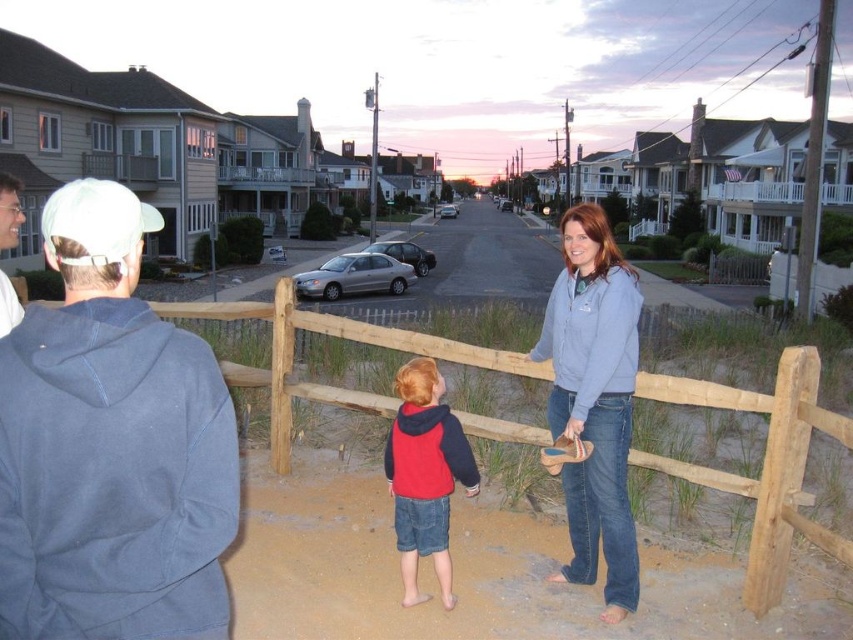
Is light blue fleece jacket at left thinner than red fleece jacket at center?

No, light blue fleece jacket at left is not thinner than red fleece jacket at center.

Does light blue fleece jacket at left appear on the right side of red fleece jacket at center?

In fact, light blue fleece jacket at left is to the left of red fleece jacket at center.

Describe the element at coordinates (111, 445) in the screenshot. The width and height of the screenshot is (853, 640). I see `light blue fleece jacket at left` at that location.

The width and height of the screenshot is (853, 640). I want to click on light blue fleece jacket at left, so click(x=111, y=445).

Between point (769, 529) and point (578, 392), which one is positioned behind?

Positioned behind is point (769, 529).

Is wooden fence at center above denim jacket at center?

No, wooden fence at center is not above denim jacket at center.

The width and height of the screenshot is (853, 640). What do you see at coordinates (762, 464) in the screenshot? I see `wooden fence at center` at bounding box center [762, 464].

Where is `wooden fence at center`? This screenshot has height=640, width=853. wooden fence at center is located at coordinates (762, 464).

Which is more to the left, light blue fleece jacket at left or wooden fence at center?

Positioned to the left is light blue fleece jacket at left.

Is light blue fleece jacket at left positioned at the back of wooden fence at center?

No, light blue fleece jacket at left is in front of wooden fence at center.

Is point (125, 432) more distant than point (451, 362)?

That is False.

Locate an element on the screen. The width and height of the screenshot is (853, 640). light blue fleece jacket at left is located at coordinates (111, 445).